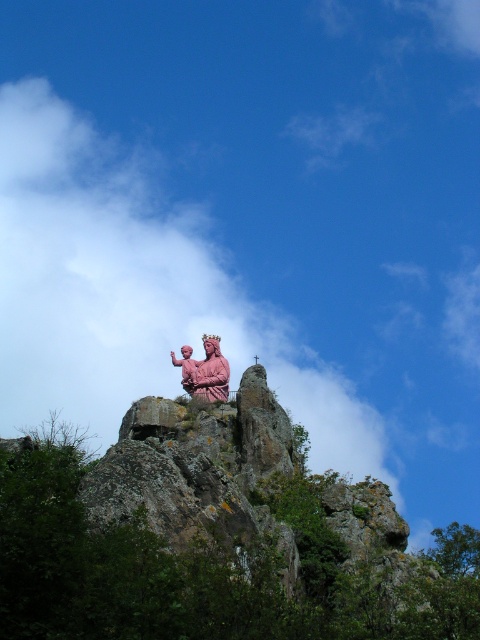
You are a drone operator tasked with capturing aerial footage of the pink polished statue at upper center. The statue is located at coordinates point 0.580, 0.427. To ensure safety, your drone must stay above 0.4 meters altitude at all times. Given the statue is at this point, can your drone safely hover above it without descending below the minimum altitude?

The pink polished statue at upper center is located at point [204,371]. Since the required minimum altitude is 0.4 meters, the drone can safely hover above it as the statue is positioned at 0.427, which is above the 0.4 meter threshold.